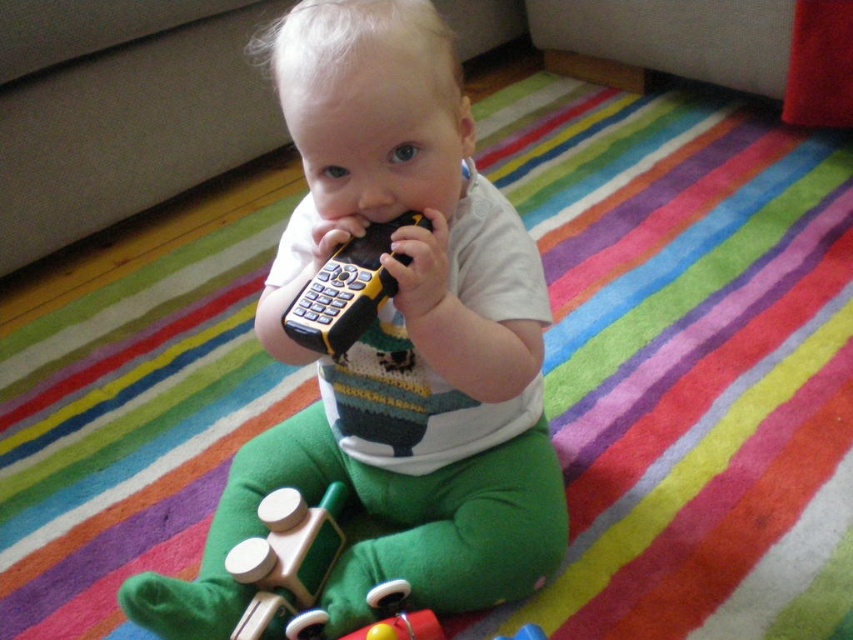
Question: Is wooden toy car at center further to the viewer compared to wooden train at lower center?

Choices:
 (A) no
 (B) yes

Answer: (A)

Question: Which point is farther to the camera?

Choices:
 (A) (329, 536)
 (B) (460, 483)
 (C) (341, 244)

Answer: (B)

Question: Which of these objects is positioned closest to the yellow plastic remote at center?

Choices:
 (A) wooden toy car at center
 (B) wooden train at lower center

Answer: (A)

Question: Can you confirm if wooden toy car at center is thinner than yellow plastic remote at center?

Choices:
 (A) yes
 (B) no

Answer: (B)

Question: Can you confirm if wooden toy car at center is thinner than wooden train at lower center?

Choices:
 (A) no
 (B) yes

Answer: (A)

Question: Which object appears closest to the camera in this image?

Choices:
 (A) wooden train at lower center
 (B) wooden toy car at center
 (C) yellow plastic remote at center

Answer: (C)